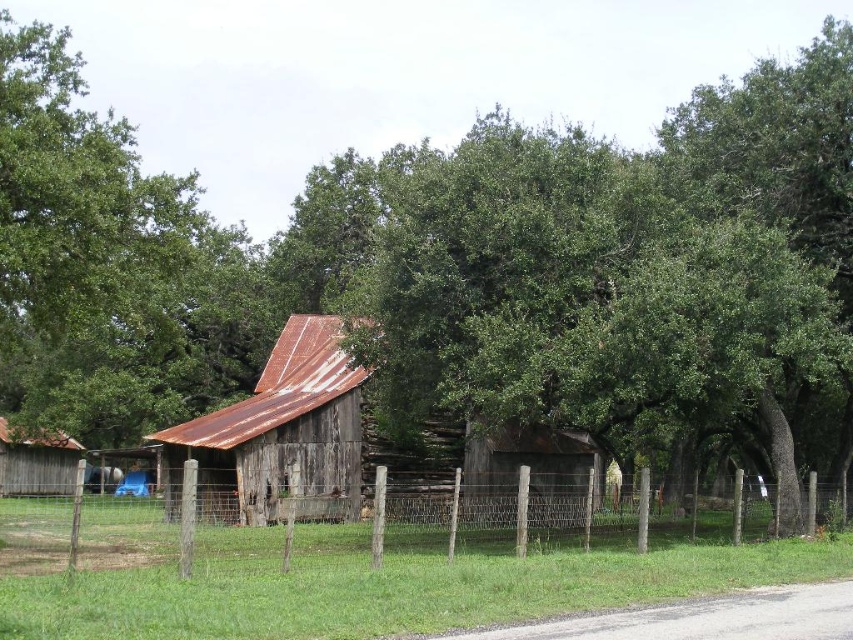
Does rusty wood barn at center appear on the left side of rusty wood barn at left?

No, rusty wood barn at center is not to the left of rusty wood barn at left.

How distant is rusty wood barn at center from rusty wood barn at left?

The distance of rusty wood barn at center from rusty wood barn at left is 55.19 feet.

Where is `rusty wood barn at center`? This screenshot has width=853, height=640. rusty wood barn at center is located at coordinates 283,428.

Consider the image. Is wooden fence at center closer to camera compared to rusty wood barn at left?

Yes, it is in front of rusty wood barn at left.

Does point (317, 545) come farther from viewer compared to point (26, 472)?

No, (317, 545) is in front of (26, 472).

Identify the location of wooden fence at center. The height and width of the screenshot is (640, 853). (119, 536).

Does green leafy tree at upper left appear under wooden fence at center?

No.

Who is taller, green leafy tree at upper left or wooden fence at center?

green leafy tree at upper left

The height and width of the screenshot is (640, 853). Identify the location of green leafy tree at upper left. (109, 266).